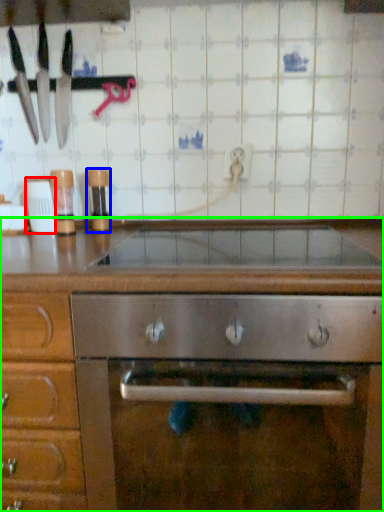
Question: Based on their relative distances, which object is farther from appliance (highlighted by a red box)? Choose from appliance (highlighted by a blue box) and cabinetry (highlighted by a green box).

Choices:
 (A) appliance
 (B) cabinetry

Answer: (B)